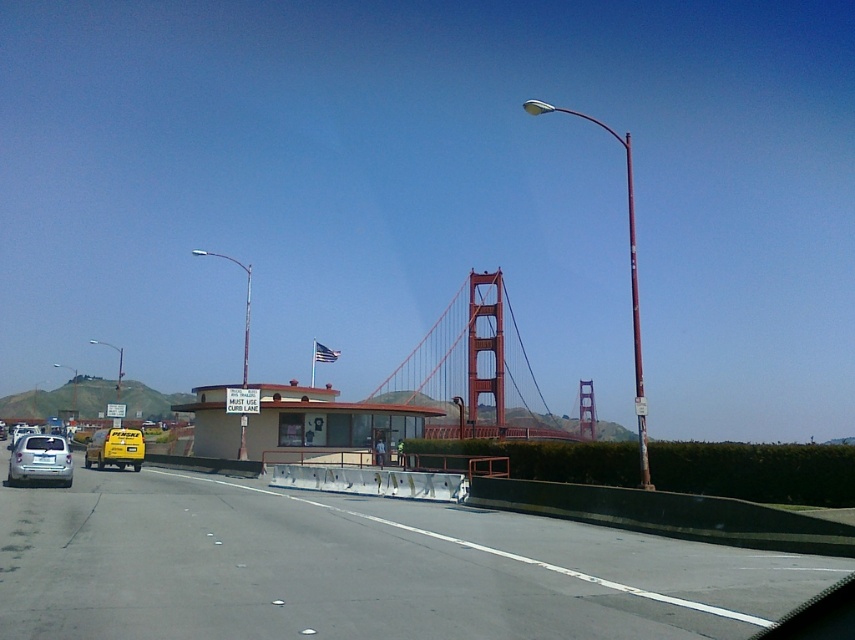
Question: Which point is closer to the camera?

Choices:
 (A) yellow matte taxi at left
 (B) red painted steel bridge at center
 (C) satin silver sedan at left
 (D) gray asphalt highway at center

Answer: (D)

Question: Considering the real-world distances, which object is farthest from the red painted steel bridge at center?

Choices:
 (A) gray asphalt highway at center
 (B) satin silver sedan at left

Answer: (B)

Question: Can you confirm if gray asphalt highway at center is positioned below yellow matte taxi at left?

Choices:
 (A) no
 (B) yes

Answer: (A)

Question: Does gray asphalt highway at center appear over red painted steel bridge at center?

Choices:
 (A) yes
 (B) no

Answer: (A)

Question: Among these points, which one is nearest to the camera?

Choices:
 (A) (413, 394)
 (B) (10, 444)
 (C) (394, 547)
 (D) (140, 460)

Answer: (C)

Question: From the image, what is the correct spatial relationship of gray asphalt highway at center in relation to red painted steel bridge at center?

Choices:
 (A) right
 (B) left

Answer: (B)